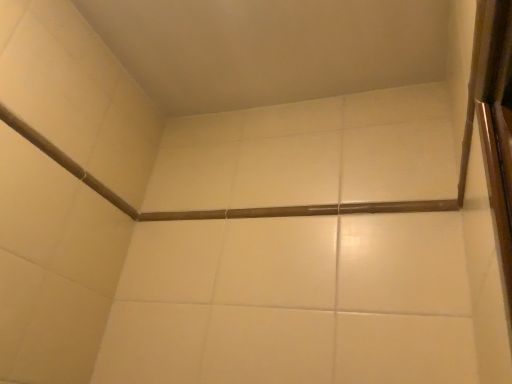
Describe the element at coordinates (307, 210) in the screenshot. The image size is (512, 384). I see `brown matte beam at center` at that location.

This screenshot has width=512, height=384. I want to click on brown matte beam at center, so click(307, 210).

I want to click on brown matte beam at center, so click(x=307, y=210).